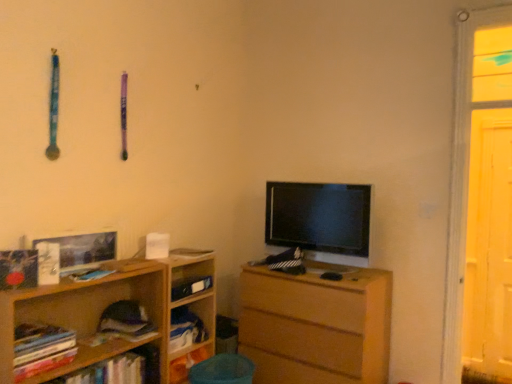
Question: Should I look upward or downward to see soft purple fabric book at lower left, acting as the second book starting from the back?

Choices:
 (A) up
 (B) down

Answer: (B)

Question: Does wooden bookshelf at left, which is the 2th shelf in back-to-front order, appear on the left side of hardcover books at left, acting as the first book starting from the front?

Choices:
 (A) yes
 (B) no

Answer: (B)

Question: From the image's perspective, is wooden bookshelf at left, the 1th shelf when ordered from front to back, beneath hardcover books at left, acting as the first book starting from the front?

Choices:
 (A) no
 (B) yes

Answer: (B)

Question: Is the depth of wooden bookshelf at left, which is the 2th shelf in back-to-front order, less than that of hardcover books at left, positioned as the 4th book in back-to-front order?

Choices:
 (A) no
 (B) yes

Answer: (B)

Question: Is wooden bookshelf at left, which is the 2th shelf in back-to-front order, positioned beyond the bounds of hardcover books at left, acting as the first book starting from the front?

Choices:
 (A) no
 (B) yes

Answer: (B)

Question: From the image's perspective, does wooden bookshelf at left, the 1th shelf when ordered from front to back, appear higher than hardcover books at left, acting as the first book starting from the front?

Choices:
 (A) no
 (B) yes

Answer: (A)

Question: From a real-world perspective, is wooden bookshelf at left, the 1th shelf when ordered from front to back, below hardcover books at left, acting as the first book starting from the front?

Choices:
 (A) no
 (B) yes

Answer: (B)

Question: Is black glossy tv at center inside hardcover book at center, which is counted as the third book, starting from the back?

Choices:
 (A) no
 (B) yes

Answer: (A)

Question: From a real-world perspective, is hardcover book at center, the second book viewed from the front, over black glossy tv at center?

Choices:
 (A) yes
 (B) no

Answer: (B)

Question: Can you confirm if hardcover book at center, the second book viewed from the front, is positioned to the right of black glossy tv at center?

Choices:
 (A) no
 (B) yes

Answer: (A)

Question: Is hardcover book at center, the second book viewed from the front, smaller than black glossy tv at center?

Choices:
 (A) yes
 (B) no

Answer: (A)

Question: From the image's perspective, is hardcover book at center, the second book viewed from the front, below black glossy tv at center?

Choices:
 (A) no
 (B) yes

Answer: (B)

Question: Is hardcover book at center, the second book viewed from the front, at the left side of black glossy tv at center?

Choices:
 (A) no
 (B) yes

Answer: (B)

Question: Is black glossy tv at center surrounding hardcover book at center, the second book viewed from the front?

Choices:
 (A) yes
 (B) no

Answer: (B)